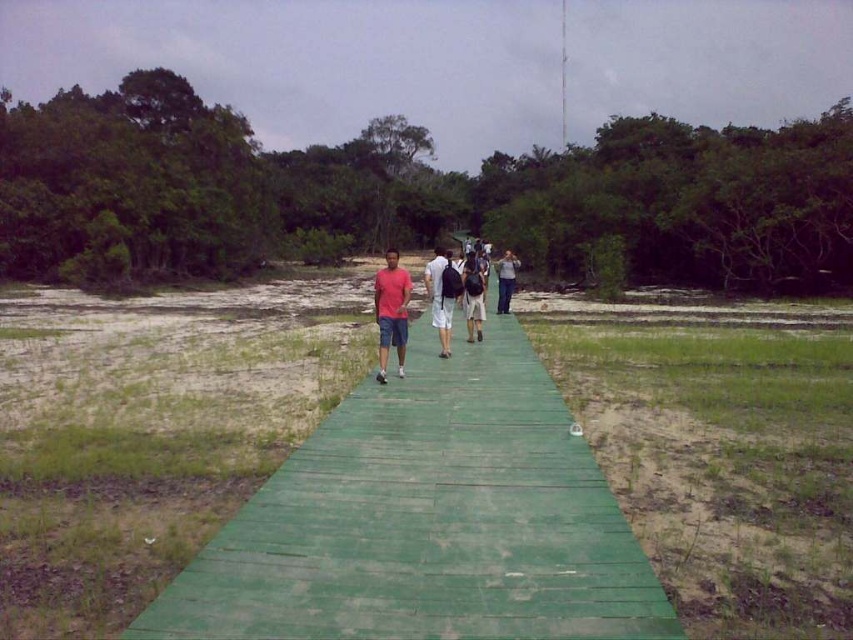
Which is behind, point (427, 266) or point (502, 307)?

Point (502, 307)

Does point (445, 317) come in front of point (509, 284)?

That is True.

This screenshot has height=640, width=853. What are the coordinates of `light gray backpack at center` in the screenshot? It's located at (x=440, y=296).

Is light gray backpack at center closer to the viewer compared to matte black backpack at center?

Yes, light gray backpack at center is in front of matte black backpack at center.

In the scene shown: Between light gray backpack at center and matte black backpack at center, which one is positioned lower?

matte black backpack at center is lower down.

This screenshot has width=853, height=640. In order to click on light gray backpack at center in this screenshot , I will do `click(440, 296)`.

Find the location of `light gray backpack at center`. light gray backpack at center is located at coordinates (440, 296).

Who is lower down, green wooden path at center or light gray backpack at center?

green wooden path at center

Can you confirm if green wooden path at center is smaller than light gray backpack at center?

Indeed, green wooden path at center has a smaller size compared to light gray backpack at center.

At what (x,y) coordinates should I click in order to perform the action: click on green wooden path at center. Please return your answer as a coordinate pair (x, y). The height and width of the screenshot is (640, 853). Looking at the image, I should click on (428, 522).